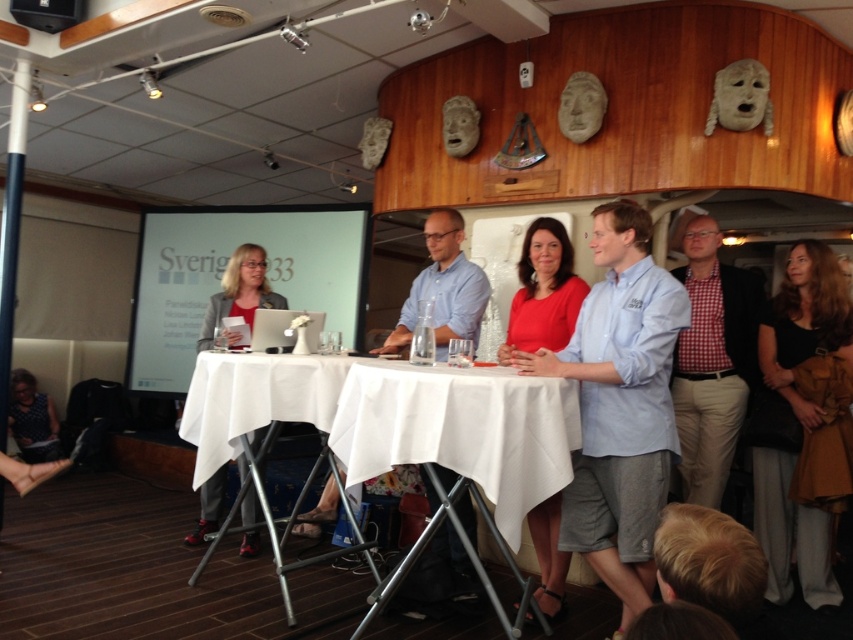
Does black fabric dress at center have a greater width compared to red checkered shirt at right?

Indeed, black fabric dress at center has a greater width compared to red checkered shirt at right.

Looking at this image, who is positioned more to the left, black fabric dress at center or red checkered shirt at right?

Positioned to the left is red checkered shirt at right.

Is point (772, 566) positioned before point (753, 385)?

Yes, point (772, 566) is closer to viewer.

This screenshot has width=853, height=640. Identify the location of black fabric dress at center. (805, 422).

Is point (416, 410) positioned after point (10, 384)?

No, (416, 410) is in front of (10, 384).

Which of these two, white cloth-covered table at center or dark blue dotted dress at lower left, stands shorter?

With less height is white cloth-covered table at center.

Who is more forward, [383,397] or [38,397]?

Point [383,397] is more forward.

This screenshot has width=853, height=640. Find the location of `white cloth-covered table at center`. white cloth-covered table at center is located at coordinates (376, 420).

Is white matte projection screen at center taller than matte gray blazer at center?

Yes, white matte projection screen at center is taller than matte gray blazer at center.

Is point (257, 241) positioned after point (212, 323)?

Yes, it is.

Between point (165, 348) and point (207, 301), which one is positioned behind?

The point (165, 348) is behind.

The image size is (853, 640). I want to click on white matte projection screen at center, so click(223, 275).